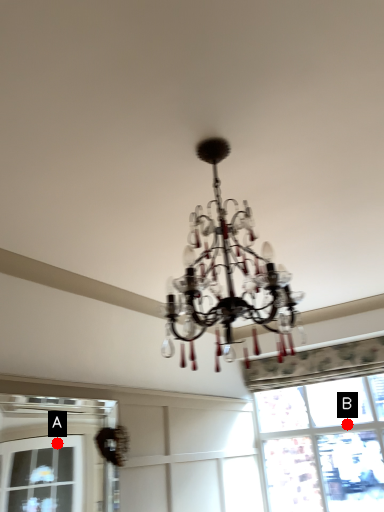
Question: Two points are circled on the image, labeled by A and B beside each circle. Which of the following is the farthest from the observer?

Choices:
 (A) A is further
 (B) B is further

Answer: (A)